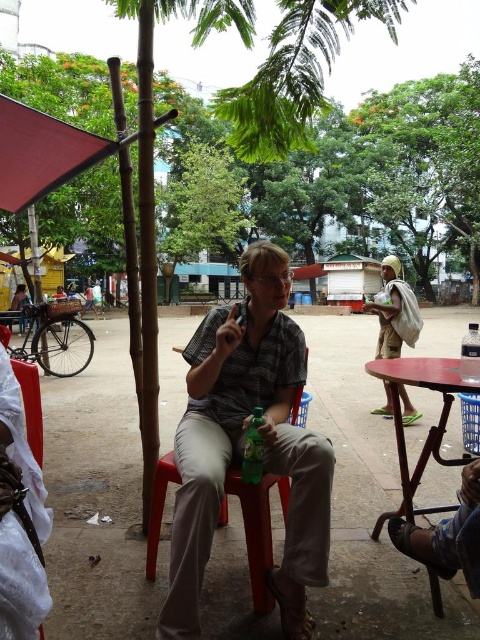
You are standing in the outdoor setting shown in the image. You want to take a photo of the green leafy tree at upper center without any obstructions. Which objects from the scene might block your view of the tree?

The green leafy tree at upper center is 16.29 meters away from the viewer. However, the red umbrella or canopy to the left of the seated person and the bicycle parked nearby could potentially block your view depending on their positioning and the angle from which you take the photo.

You are a delivery person who needs to cover your package from rain. You see the matte red canopy at upper left and the white fabric bag at right. Which item can provide better protection against rain?

The matte red canopy at upper left is bigger than the white fabric bag at right, so it can provide better protection against rain.

You are a delivery person who needs to place a small package between the matte gray shirt at center and the matte plastic stool at center. The package is 6 inches long. Can you fit it between them without moving either object?

The distance between the matte gray shirt at center and the matte plastic stool at center is 5.50 inches, which is shorter than the 6 inch package. Therefore, the package cannot be placed between them without moving either object.